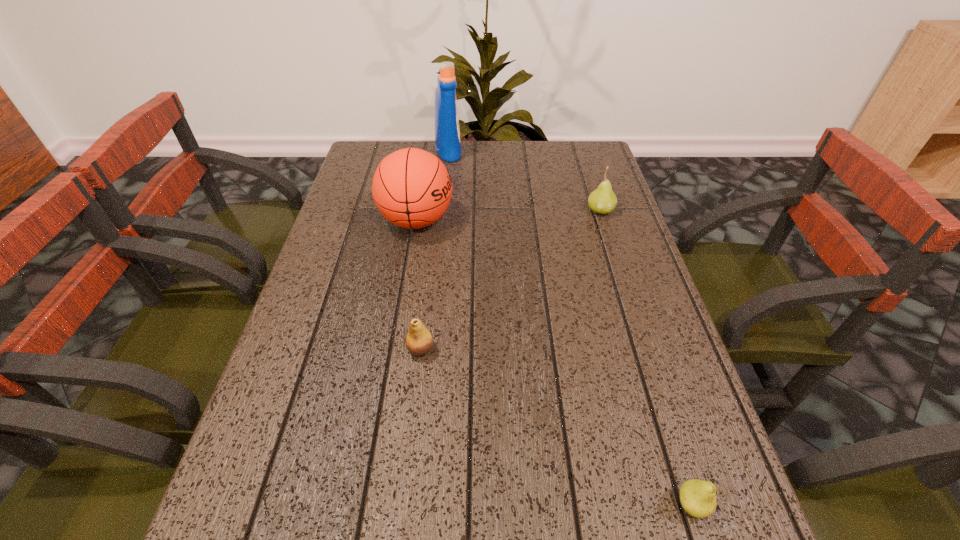
Where is `free point located 0.220m on the front of the second nearest object`? Image resolution: width=960 pixels, height=540 pixels. free point located 0.220m on the front of the second nearest object is located at coordinates (406, 476).

The height and width of the screenshot is (540, 960). Identify the location of vacant region located 0.260m on the back of the nearest object. (643, 352).

Identify the location of object present at the far edge. The image size is (960, 540). (447, 132).

Find the location of a particular element. The width and height of the screenshot is (960, 540). object that is positioned at the left edge is located at coordinates (412, 188).

At what (x,y) coordinates should I click in order to perform the action: click on blank space at the far edge of the desktop. Please return your answer as a coordinate pair (x, y). Looking at the image, I should click on (474, 173).

The image size is (960, 540). In the image, there is a desktop. Identify the location of vacant space at the left edge. (327, 436).

Identify the location of vacant space at the right edge. coord(658,329).

Where is `vacant area at the far left corner of the desktop`? The image size is (960, 540). vacant area at the far left corner of the desktop is located at coordinates (369, 144).

In the image, there is a desktop. Identify the location of free space at the far right corner. This screenshot has width=960, height=540. (560, 155).

Identify the location of vacant space that's between the farthest pear and the nearest object. The width and height of the screenshot is (960, 540). (646, 357).